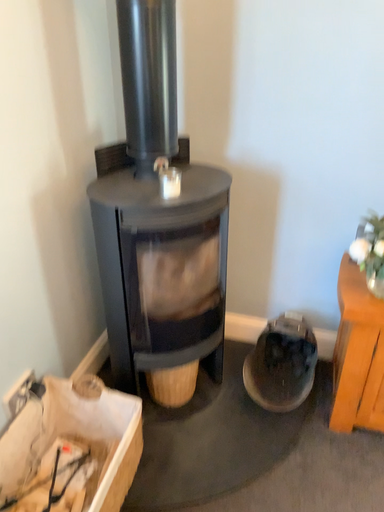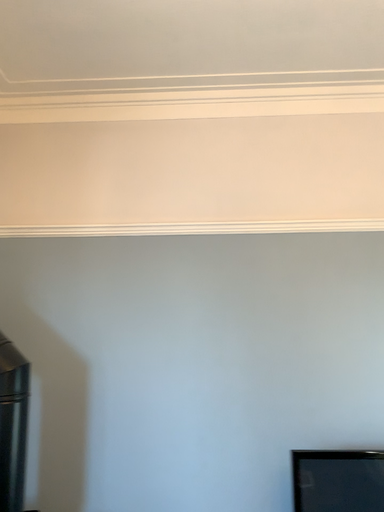
Question: How did the camera likely rotate when shooting the video?

Choices:
 (A) rotated downward
 (B) rotated upward

Answer: (B)